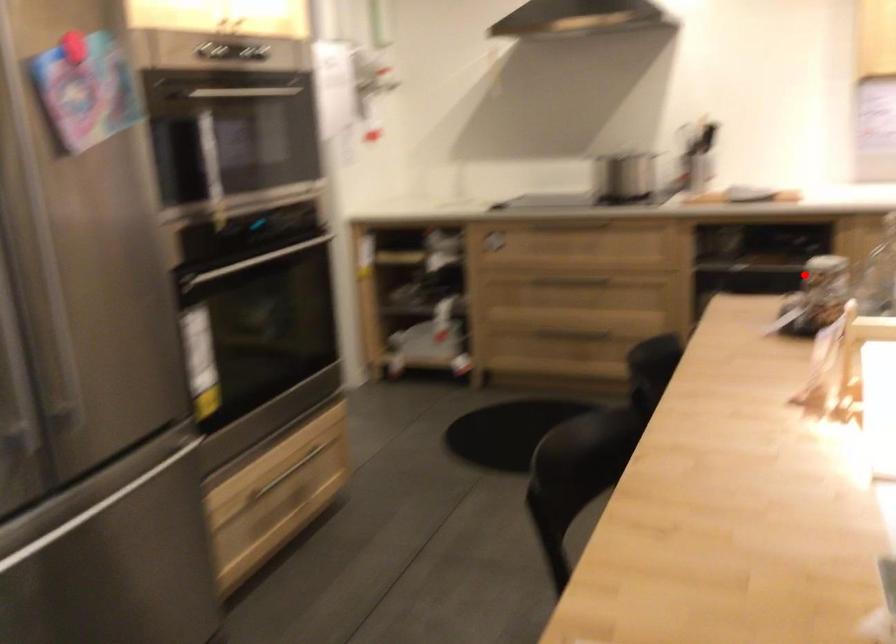
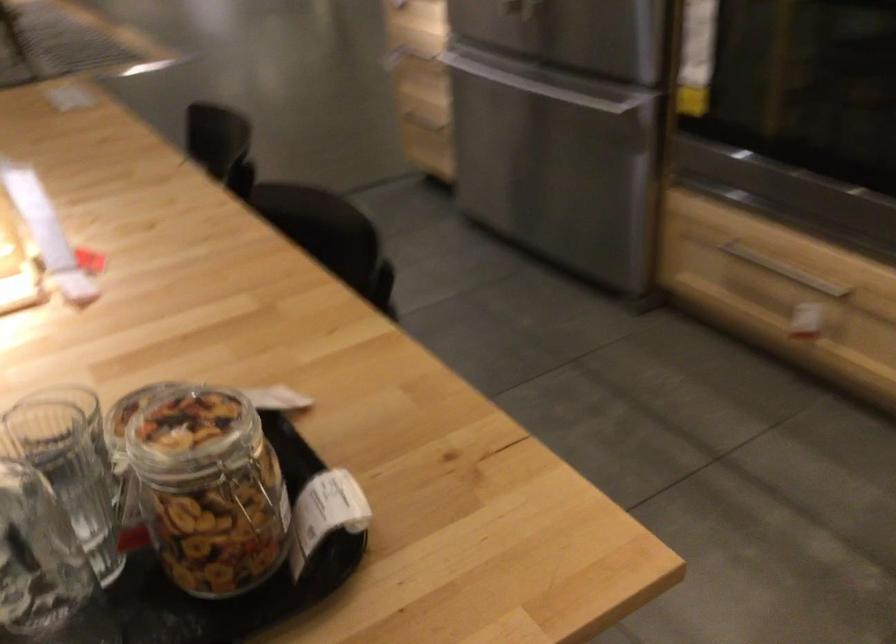
Question: A red point is marked in image1. In image2, is the corresponding 3D point closer to the camera or farther? Reply with the corresponding letter.

Choices:
 (A) The corresponding 3D point is closer.
 (B) The corresponding 3D point is farther.

Answer: (A)